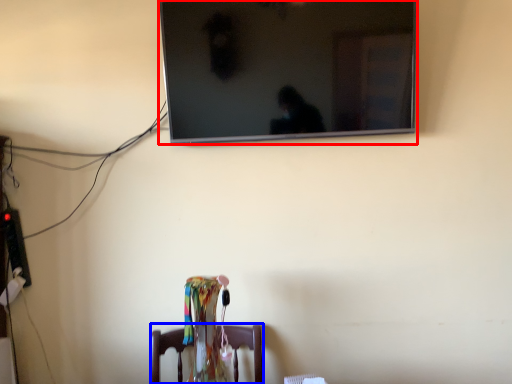
Question: Which point is closer to the camera, television (highlighted by a red box) or furniture (highlighted by a blue box)?

Choices:
 (A) television
 (B) furniture

Answer: (B)